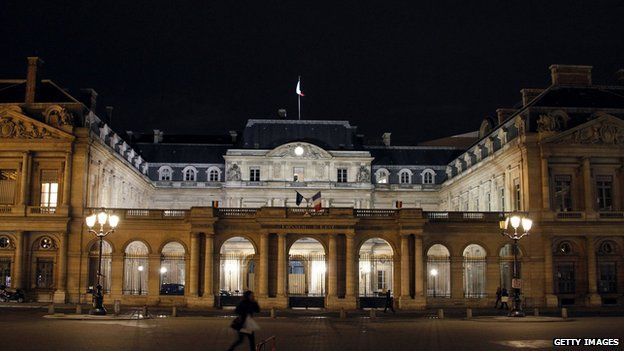
The image size is (624, 351). Identify the location of light fixture. point(520,232).